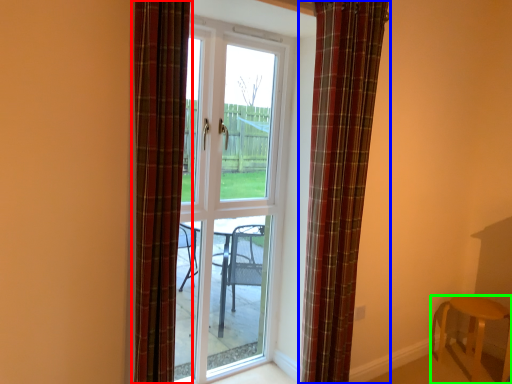
Question: Which object is positioned farthest from curtain (highlighted by a red box)? Select from curtain (highlighted by a blue box) and furniture (highlighted by a green box).

Choices:
 (A) curtain
 (B) furniture

Answer: (B)